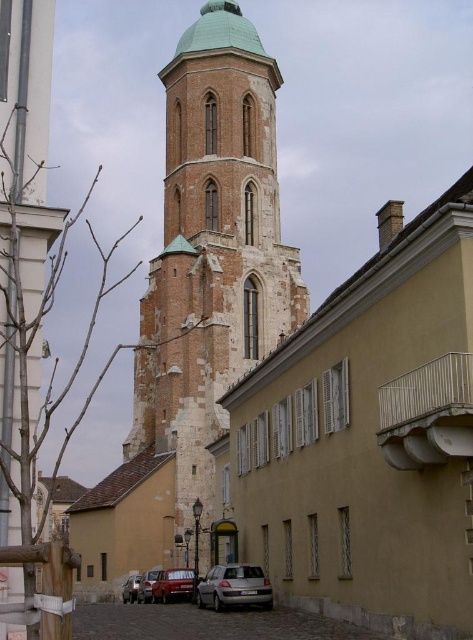
Question: Is matte red car at center to the right of metallic silver car at center from the viewer's perspective?

Choices:
 (A) yes
 (B) no

Answer: (A)

Question: Where is brown brick tower at center located in relation to matte red car at center in the image?

Choices:
 (A) below
 (B) above

Answer: (B)

Question: Does brown brick tower at center come in front of shiny silver car at lower left?

Choices:
 (A) yes
 (B) no

Answer: (B)

Question: Which point appears farthest from the camera in this image?

Choices:
 (A) (175, 596)
 (B) (151, 596)
 (C) (283, 321)
 (D) (252, 602)

Answer: (C)

Question: Which of the following is the farthest from the observer?

Choices:
 (A) brown brick tower at center
 (B) metallic silver car at center

Answer: (B)

Question: Among these points, which one is nearest to the camera?

Choices:
 (A) (142, 577)
 (B) (131, 596)
 (C) (238, 564)
 (D) (157, 576)

Answer: (C)